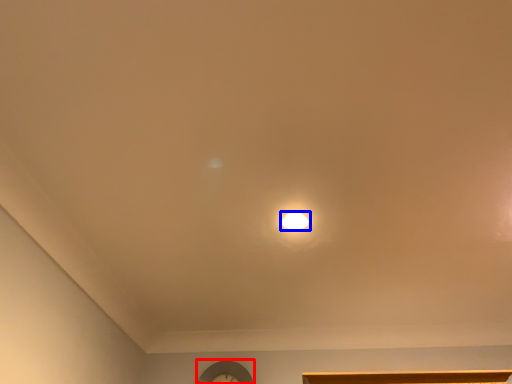
Question: Which object appears closest to the camera in this image, clock (highlighted by a red box) or lamp (highlighted by a blue box)?

Choices:
 (A) clock
 (B) lamp

Answer: (B)